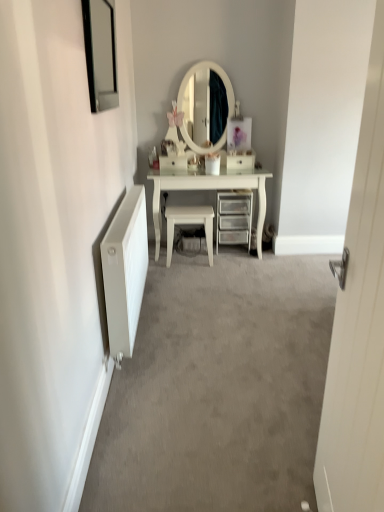
Locate an element on the screen. Image resolution: width=384 pixels, height=512 pixels. spots to the right of white matte radiator at left is located at coordinates (214, 330).